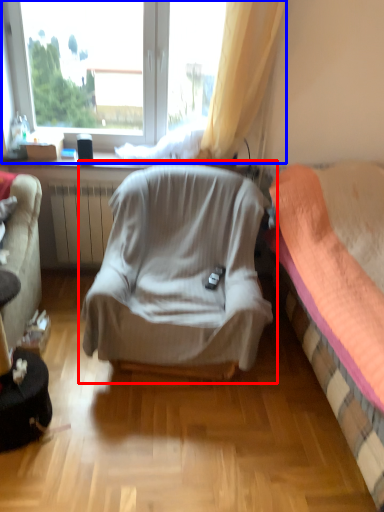
Question: Which object is further to the camera taking this photo, chair (highlighted by a red box) or window (highlighted by a blue box)?

Choices:
 (A) chair
 (B) window

Answer: (B)